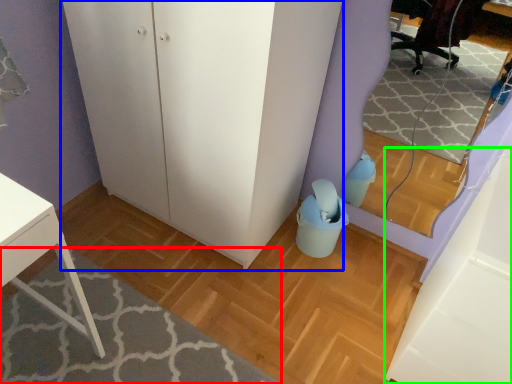
Question: Based on their relative distances, which object is nearer to plain (highlighted by a red box)? Choose from dresser (highlighted by a blue box) and cabinetry (highlighted by a green box).

Choices:
 (A) dresser
 (B) cabinetry

Answer: (A)